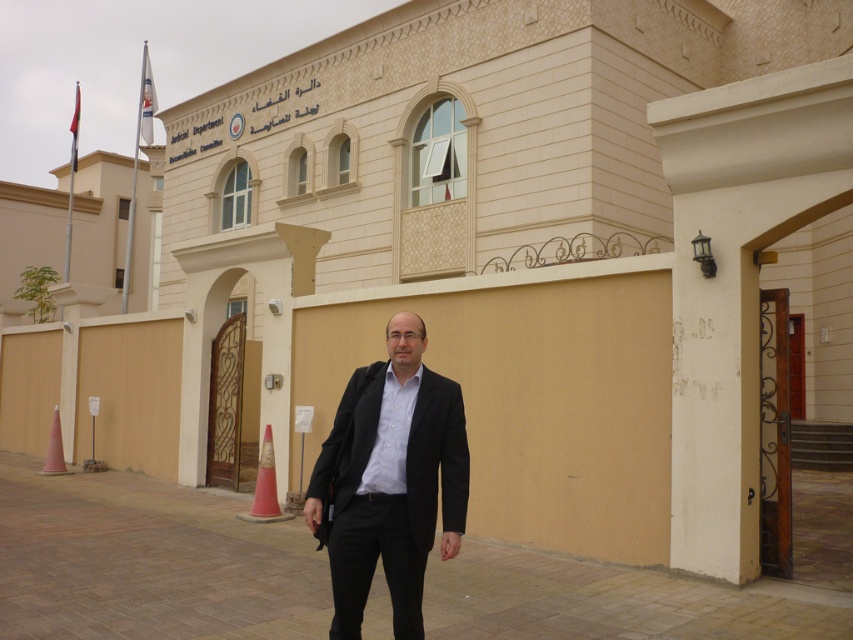
Consider the image. Who is higher up, black matte suit at center or orange plastic cone at lower center?

Positioned higher is black matte suit at center.

Which of these two, black matte suit at center or orange plastic cone at lower center, stands taller?

black matte suit at center

Is point (415, 484) less distant than point (257, 484)?

Yes, point (415, 484) is in front of point (257, 484).

At what (x,y) coordinates should I click in order to perform the action: click on black matte suit at center. Please return your answer as a coordinate pair (x, y). This screenshot has height=640, width=853. Looking at the image, I should click on (390, 481).

How distant is black matte suit at center from orange plastic cone at lower left?

black matte suit at center is 33.78 feet away from orange plastic cone at lower left.

Can you confirm if black matte suit at center is bigger than orange plastic cone at lower left?

Correct, black matte suit at center is larger in size than orange plastic cone at lower left.

Between point (343, 545) and point (45, 465), which one is positioned in front?

Point (343, 545) is more forward.

Find the location of a particular element. The image size is (853, 640). black matte suit at center is located at coordinates (390, 481).

Does orange plastic cone at lower center lie in front of orange plastic cone at lower left?

Yes, orange plastic cone at lower center is closer to the viewer.

Can you confirm if orange plastic cone at lower center is wider than orange plastic cone at lower left?

No, orange plastic cone at lower center is not wider than orange plastic cone at lower left.

Which is in front, point (258, 492) or point (56, 420)?

Point (258, 492) is in front.

Image resolution: width=853 pixels, height=640 pixels. I want to click on orange plastic cone at lower center, so click(265, 486).